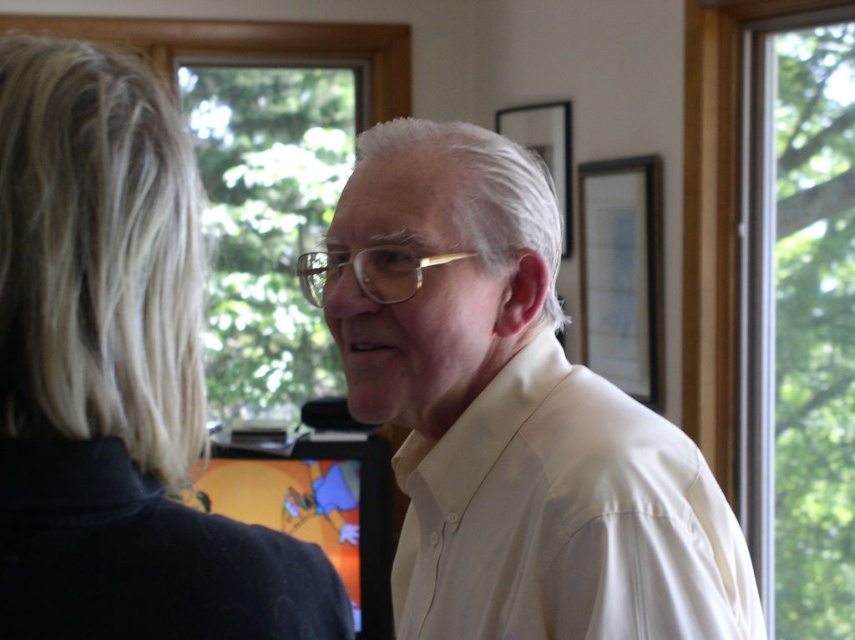
You are a photographer trying to capture a candid shot of the two people in the scene. You notice the blonde hair at left and the white smooth dress shirt at center. Which object should you focus on if you want to capture the person who is facing away from the camera?

The blonde hair at left belongs to the person facing away from the camera, so focus on the blonde hair at left to capture that individual.

You are a fashion designer analyzing the image. You need to determine which object is wider between the white matte shirt at center and the blonde hair at left. Which one is wider?

The white matte shirt at center is wider than the blonde hair at left according to the description provided.

You are a photographer standing at a distance of 36 inches from the subject. You want to take a closeup shot of the white smooth dress shirt at center. Is the current distance sufficient?

The white smooth dress shirt at center is 36.12 inches away from the viewer. Since your current distance is 36 inches, you are slightly closer than the shirt, so the distance is sufficient for a closeup shot.